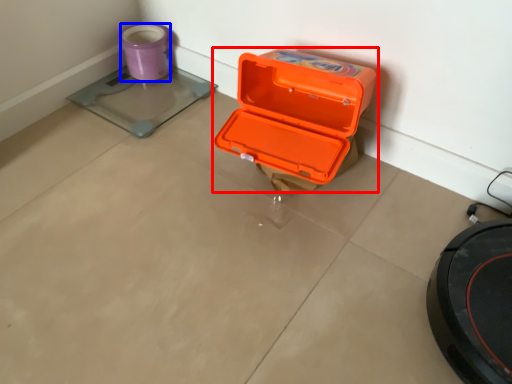
Question: Which point is further to the camera, box (highlighted by a red box) or appliance (highlighted by a blue box)?

Choices:
 (A) box
 (B) appliance

Answer: (B)